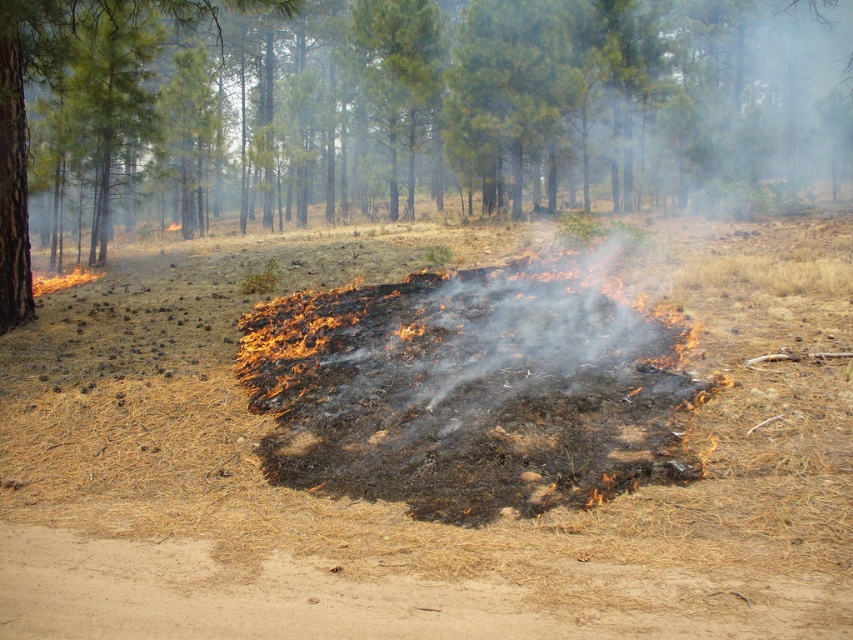
Question: Can you confirm if charcoal ash at center is bigger than green leafy tree at center?

Choices:
 (A) no
 (B) yes

Answer: (A)

Question: Does charcoal ash at center appear on the left side of green leafy tree at center?

Choices:
 (A) no
 (B) yes

Answer: (B)

Question: Which object is farther from the camera taking this photo?

Choices:
 (A) green leafy tree at center
 (B) charcoal ash at center

Answer: (A)

Question: Does charcoal ash at center have a greater width compared to green leafy tree at center?

Choices:
 (A) yes
 (B) no

Answer: (B)

Question: Which point is farther from the camera taking this photo?

Choices:
 (A) (802, 524)
 (B) (338, 179)

Answer: (B)